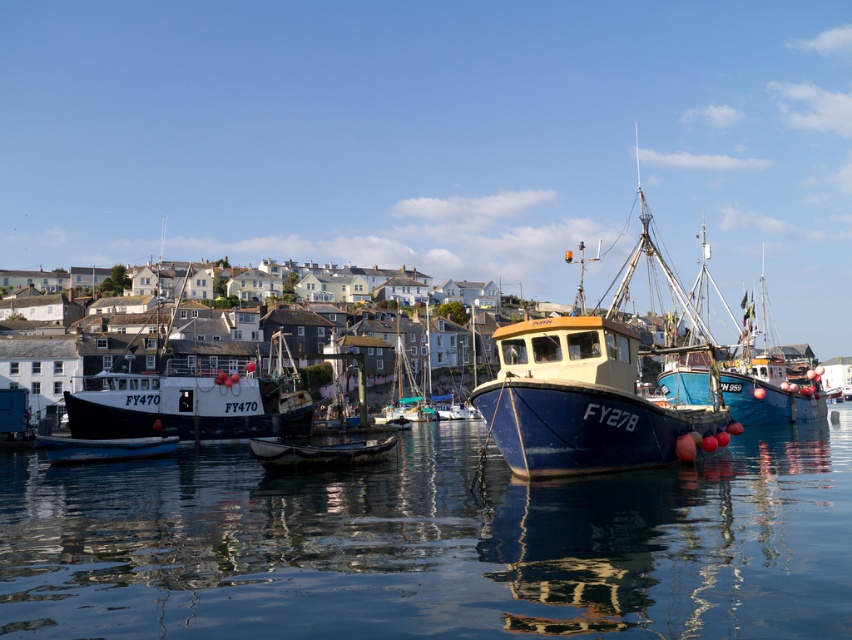
Between matte blue boat at center and white matte dinghy at center, which one is positioned lower?

Positioned lower is white matte dinghy at center.

Which is behind, point (551, 364) or point (344, 445)?

Point (344, 445)

Locate an element on the screen. matte blue boat at center is located at coordinates (586, 392).

Does point (199, 464) come in front of point (584, 332)?

No, (199, 464) is further to viewer.

Can you confirm if glossy blue water at center is bigger than matte blue boat at center?

No.

Between point (453, 547) and point (678, 417), which one is positioned behind?

The point (678, 417) is behind.

Where is `glossy blue water at center`? This screenshot has height=640, width=852. glossy blue water at center is located at coordinates (432, 545).

Can you confirm if blue matte fishing boat at center is taller than white matte dinghy at center?

Correct, blue matte fishing boat at center is much taller as white matte dinghy at center.

Does blue matte fishing boat at center come behind white matte dinghy at center?

That is True.

Between point (801, 419) and point (308, 464), which one is positioned behind?

Positioned behind is point (801, 419).

Locate an element on the screen. Image resolution: width=852 pixels, height=640 pixels. blue matte fishing boat at center is located at coordinates (747, 381).